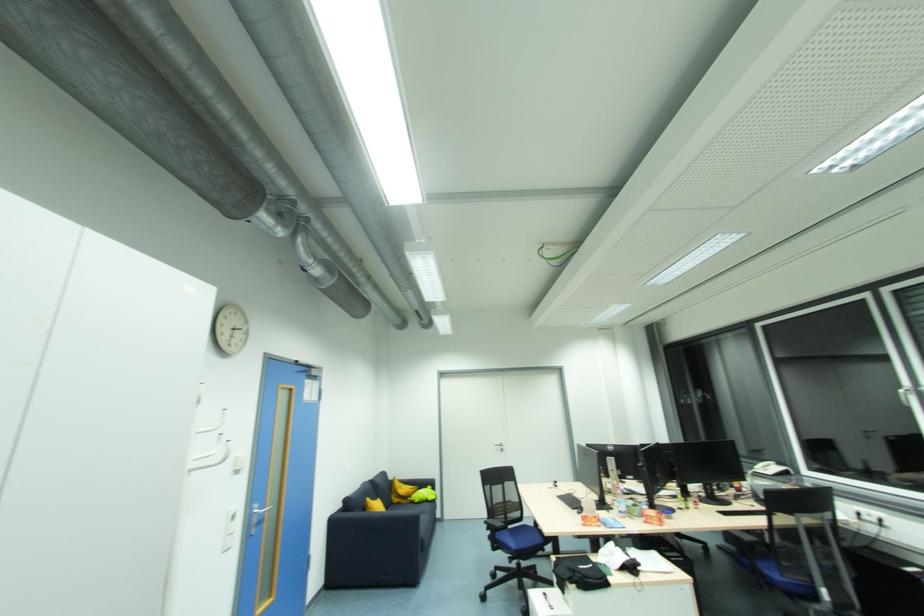
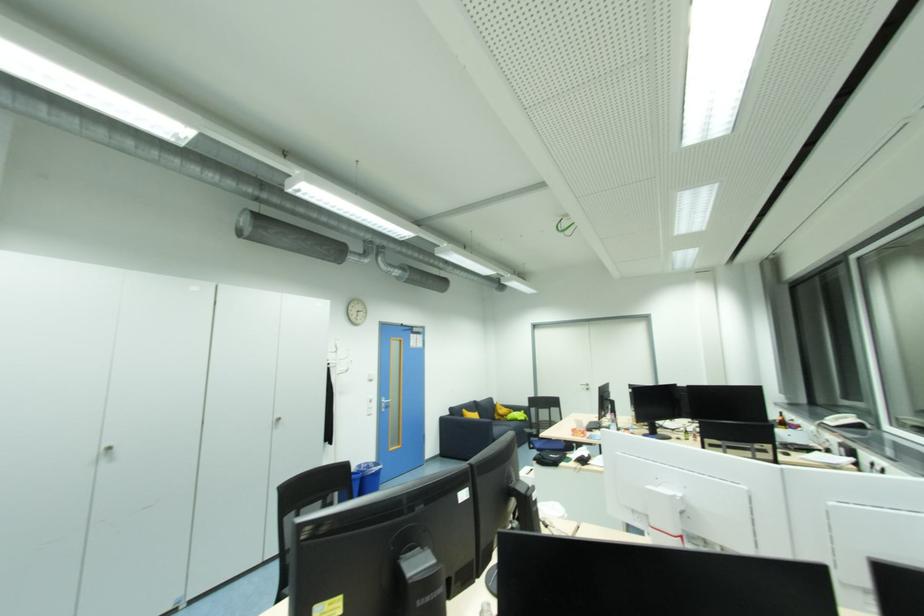
Where in the second image is the point corresponding to [257,514] from the first image?

(386, 402)